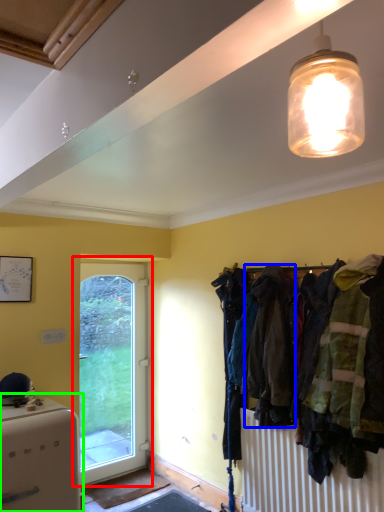
Question: Which object is positioned farthest from door (highlighted by a red box)? Select from clothing (highlighted by a blue box) and appliance (highlighted by a green box).

Choices:
 (A) clothing
 (B) appliance

Answer: (A)